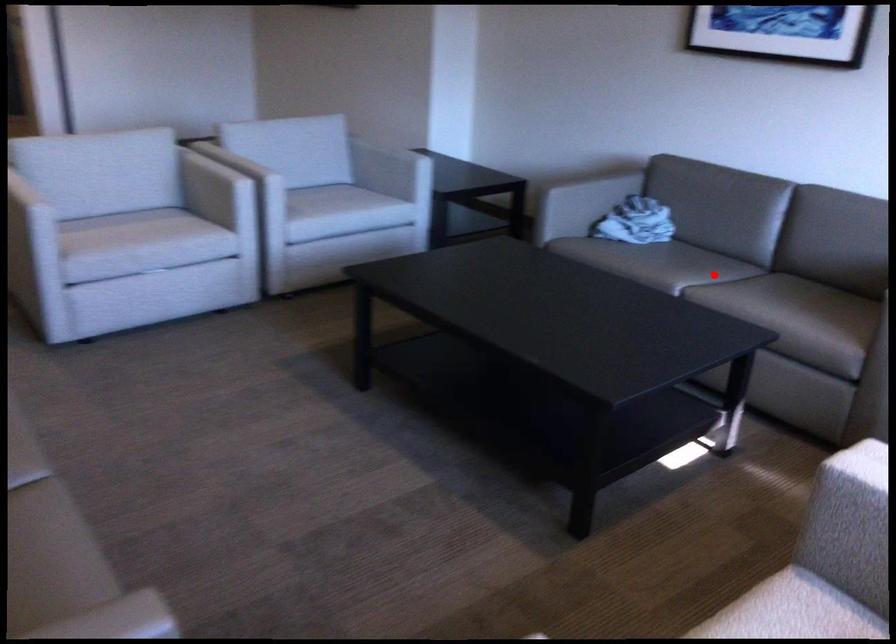
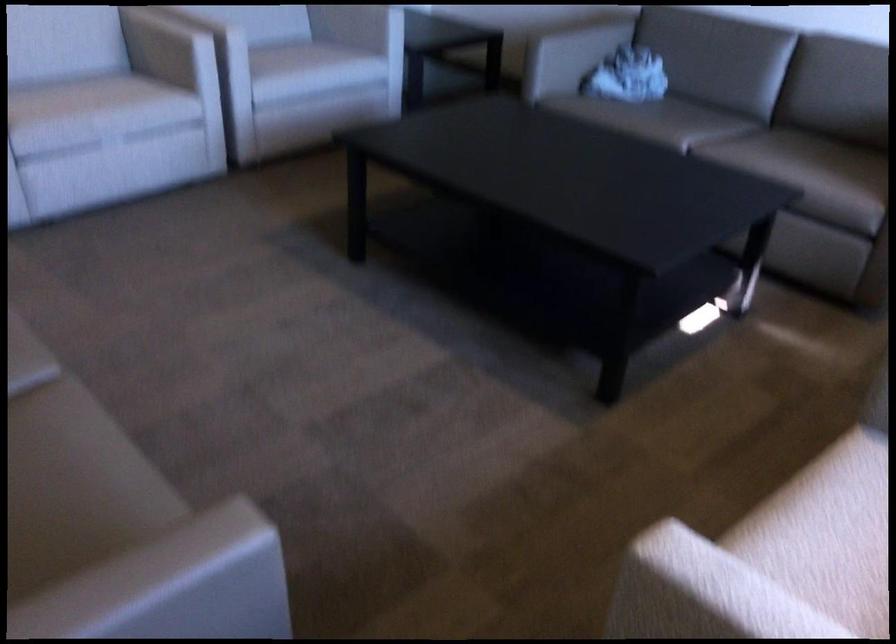
The point at the highlighted location is marked in the first image. Where is the corresponding point in the second image?

(714, 127)